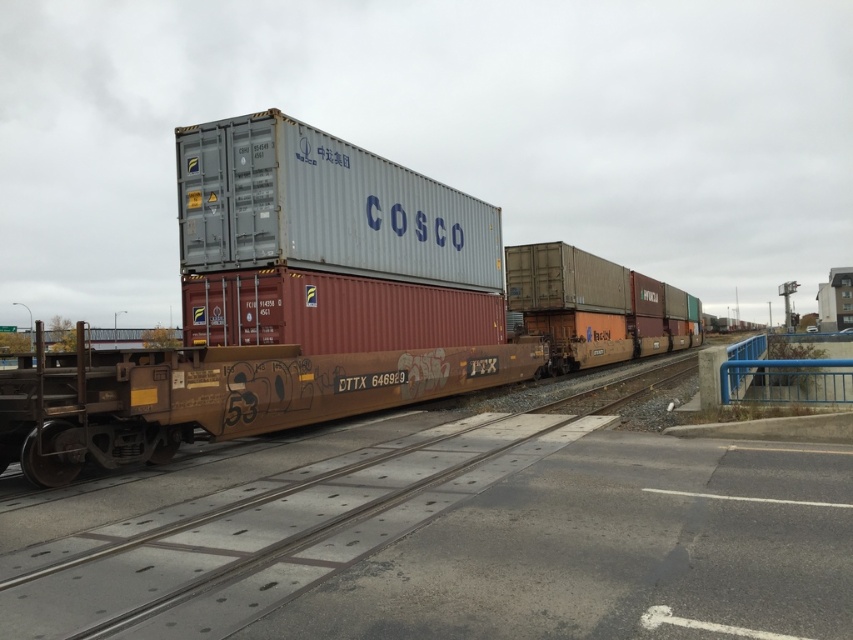
You are standing at the point marked as point (306, 307) in the image. What object is located exactly at your current position?

The metallic gray container at center is located exactly at point (306, 307).

You are a crane operator trying to load a new container onto the freight train. The new container you have is 10 meters wide. The space between the two existing containers on the train is exactly 10 meters. Can the new container fit into the space between the metallic gray container at center and the rusty metal train track at center?

The metallic gray container at center is wider than the rusty metal train track at center. Since the space between them is exactly 10 meters and the new container is also 10 meters wide, the container can fit into the space as long as there is no obstruction. However, the description does not mention the exact dimensions of the existing containers or the track, so this is an assumption based on the given width comparison.